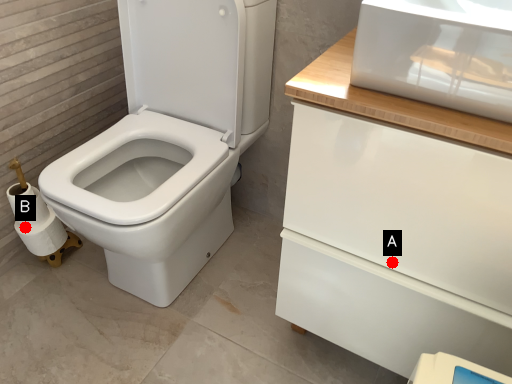
Question: Two points are circled on the image, labeled by A and B beside each circle. Which point is closer to the camera taking this photo?

Choices:
 (A) A is closer
 (B) B is closer

Answer: (A)